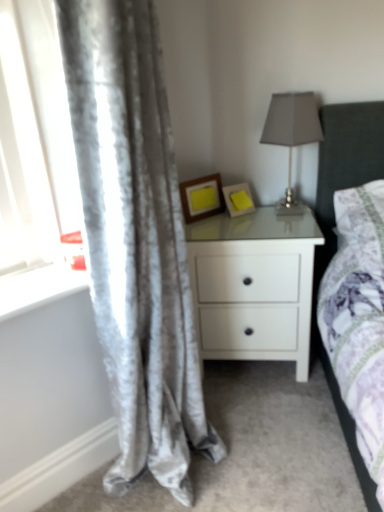
This screenshot has width=384, height=512. Identify the location of vacant space that's between yellow matte picture frame at upper center, which ranks as the first picture frame in right-to-left order, and satin gray lampshade at upper right. (251, 217).